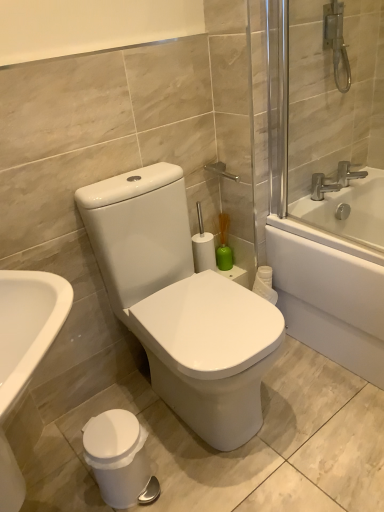
Identify the location of free space to the left of white glossy toilet at center. Image resolution: width=384 pixels, height=512 pixels. (81, 431).